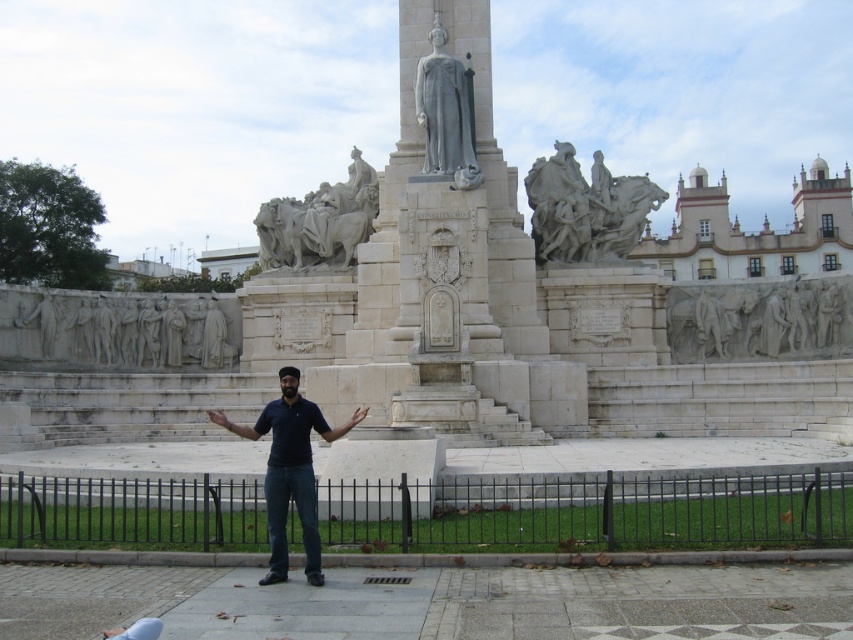
Which of these two, white stone relief at center or dark blue shirt at center, stands taller?

With more height is dark blue shirt at center.

Measure the distance from white stone relief at center to dark blue shirt at center.

38.77 meters

Which is in front, point (695, 326) or point (316, 515)?

Positioned in front is point (316, 515).

This screenshot has width=853, height=640. In order to click on white stone relief at center in this screenshot , I will do `click(759, 320)`.

Which is behind, point (685, 358) or point (222, 419)?

Positioned behind is point (685, 358).

Is white stone relief at center below brown leather hand at center?

No.

You are a GUI agent. You are given a task and a screenshot of the screen. Output one action in this format:
    pyautogui.click(x=<x>, y=<y>)
    Task: Click on the white stone relief at center
    This screenshot has height=640, width=853.
    Given the screenshot: What is the action you would take?
    pyautogui.click(x=759, y=320)

How distant is white stone relief at lower left from white stone relief at center?

They are 140.51 feet apart.

Does point (218, 356) lie in front of point (816, 284)?

No, it is not.

Which is in front, point (102, 328) or point (711, 348)?

Positioned in front is point (711, 348).

The width and height of the screenshot is (853, 640). What are the coordinates of `white stone relief at lower left` in the screenshot? It's located at (119, 330).